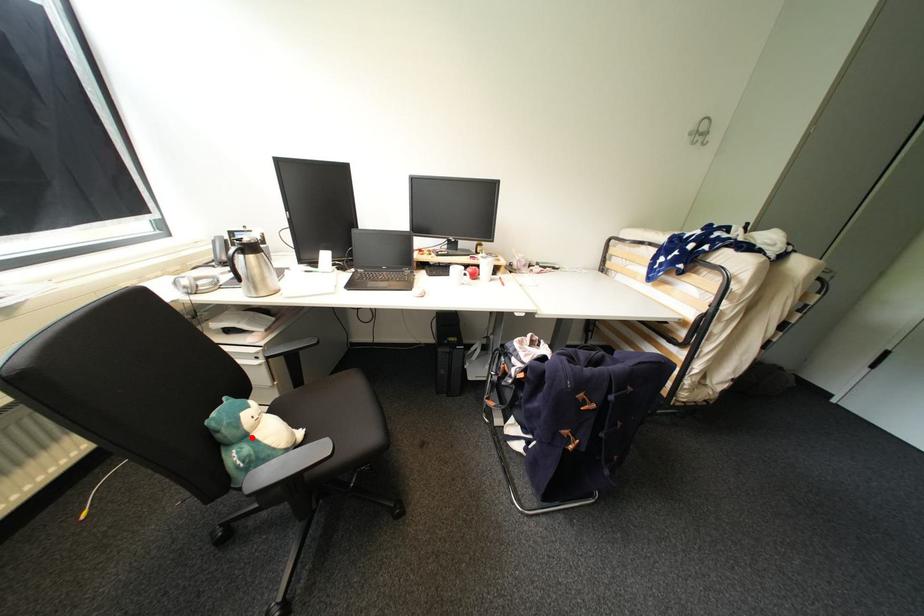
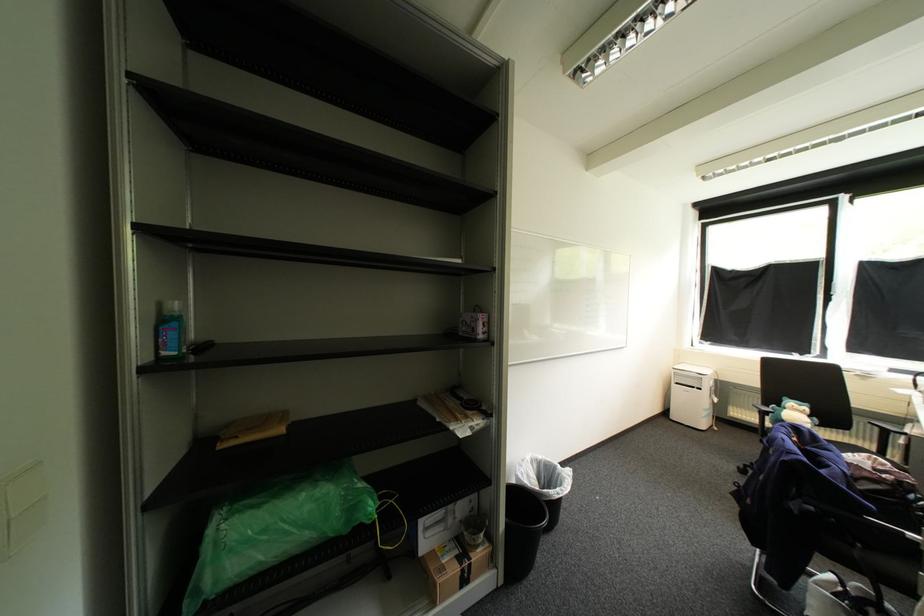
Where in the second image is the point corresponding to the highlighted location from the first image?

(792, 408)